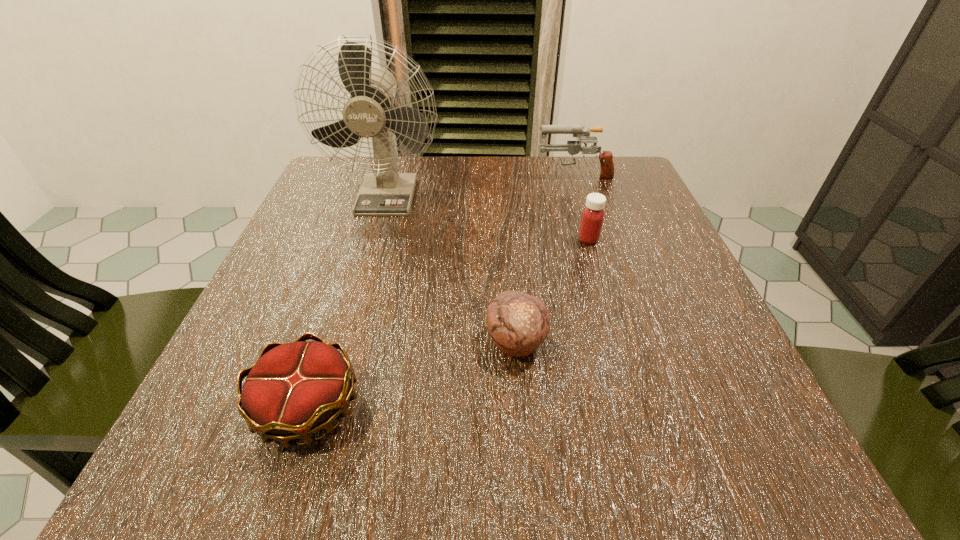
Identify the location of object located at the near left corner. Image resolution: width=960 pixels, height=540 pixels. (296, 389).

At what (x,y) coordinates should I click in order to perform the action: click on object positioned at the far right corner. Please return your answer as a coordinate pair (x, y). The height and width of the screenshot is (540, 960). Looking at the image, I should click on (573, 147).

This screenshot has height=540, width=960. I want to click on free space at the far edge, so click(x=458, y=196).

The height and width of the screenshot is (540, 960). What are the coordinates of `vacant space at the left edge of the desktop` in the screenshot? It's located at (348, 245).

I want to click on vacant position at the right edge of the desktop, so click(x=665, y=239).

Identify the location of vacant region at the far left corner of the desktop. The width and height of the screenshot is (960, 540). (372, 156).

Where is `vacant space at the near right corner of the desktop`? This screenshot has height=540, width=960. vacant space at the near right corner of the desktop is located at coordinates (682, 431).

Identify the location of vacant area that lies between the medicine and the muffin. This screenshot has width=960, height=540. (552, 291).

The image size is (960, 540). I want to click on empty space between the crown and the gun, so click(x=441, y=291).

This screenshot has width=960, height=540. Find the location of `free spot between the crown and the third object from left to right`. free spot between the crown and the third object from left to right is located at coordinates (412, 375).